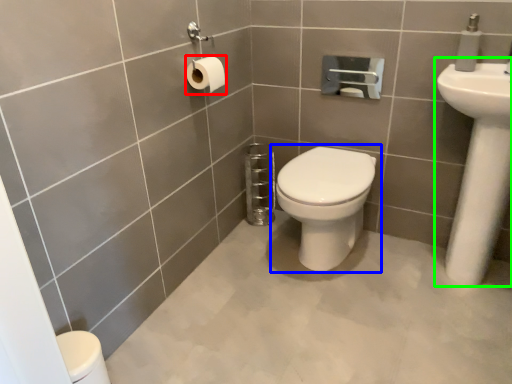
Question: Which object is the farthest from toilet paper (highlighted by a red box)? Choose among these: toilet (highlighted by a blue box) or sink (highlighted by a green box).

Choices:
 (A) toilet
 (B) sink

Answer: (B)